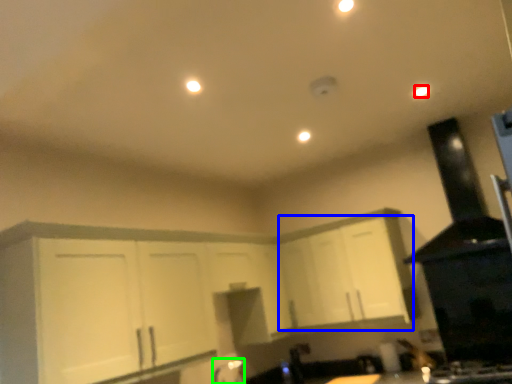
Question: Estimate the real-world distances between objects in this image. Which object is closer to light (highlighted by a red box), cabinetry (highlighted by a blue box) or faucet (highlighted by a green box)?

Choices:
 (A) cabinetry
 (B) faucet

Answer: (A)